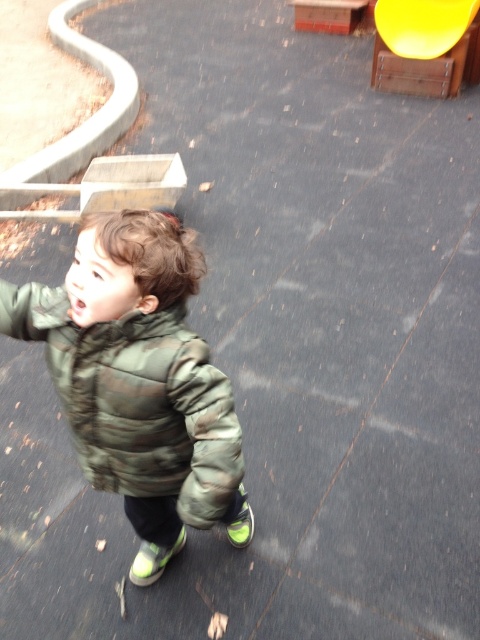
Question: Does camouflage quilted jacket at center have a lesser width compared to yellow plastic slide at upper right?

Choices:
 (A) yes
 (B) no

Answer: (A)

Question: Which point is closer to the camera?

Choices:
 (A) (478, 6)
 (B) (73, 412)

Answer: (B)

Question: Can you confirm if camouflage quilted jacket at center is bigger than yellow plastic slide at upper right?

Choices:
 (A) yes
 (B) no

Answer: (B)

Question: Which of the following is the farthest from the observer?

Choices:
 (A) (452, 45)
 (B) (219, 401)

Answer: (A)

Question: Can you confirm if camouflage quilted jacket at center is positioned to the left of yellow plastic slide at upper right?

Choices:
 (A) yes
 (B) no

Answer: (A)

Question: Which of the following is the closest to the observer?

Choices:
 (A) (79, 396)
 (B) (417, 35)

Answer: (A)